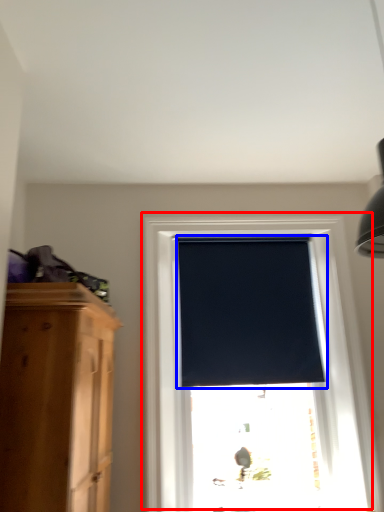
Question: Which point is further to the camera, window (highlighted by a red box) or window blind (highlighted by a blue box)?

Choices:
 (A) window
 (B) window blind

Answer: (B)